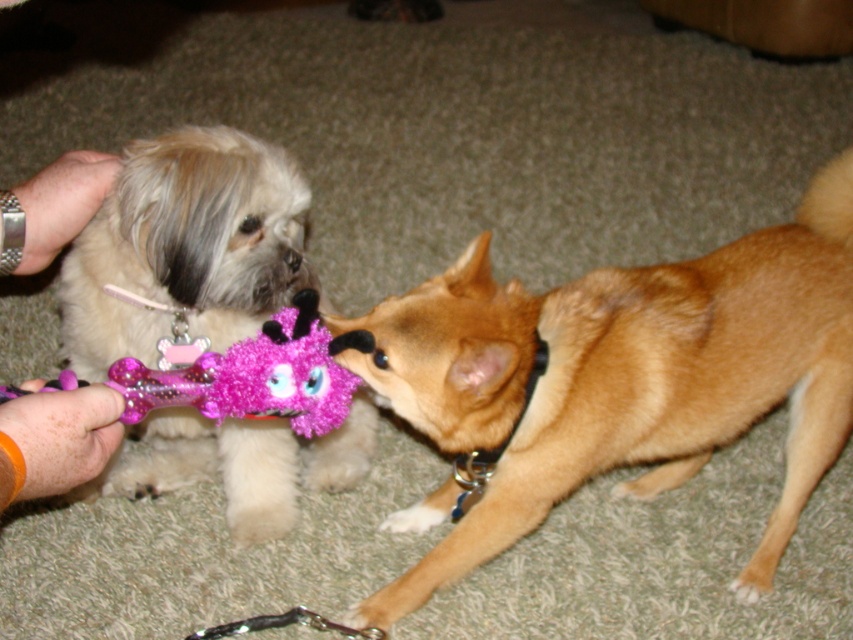
You are a dog trainer observing two dogs interacting with a toy. The dogs are a Shih Tzu on the left and a Chihuahua on the right. The toy is a fuzzy glittery bone at center. Based on the coordinates provided, which dog is closer to the toy?

The fuzzy glittery bone at center is located at coordinates point (x=256, y=376). Since the Chihuahua on the right is closer to the center point, it is closer to the toy than the Shih Tzu on the left.

You are a dog trainer observing the scene. The Shih Tzu and the tan dog are both trying to reach the pink plush bone toy. The hand holding the toy is at point (55, 442). Which dog is closer to the hand holding the toy?

The point at (55, 442) marks the smooth skin hand at upper left. Since the Shih Tzu is on the left side and the hand is at upper left, the Shih Tzu is closer to the hand holding the toy than the tan dog on the right.